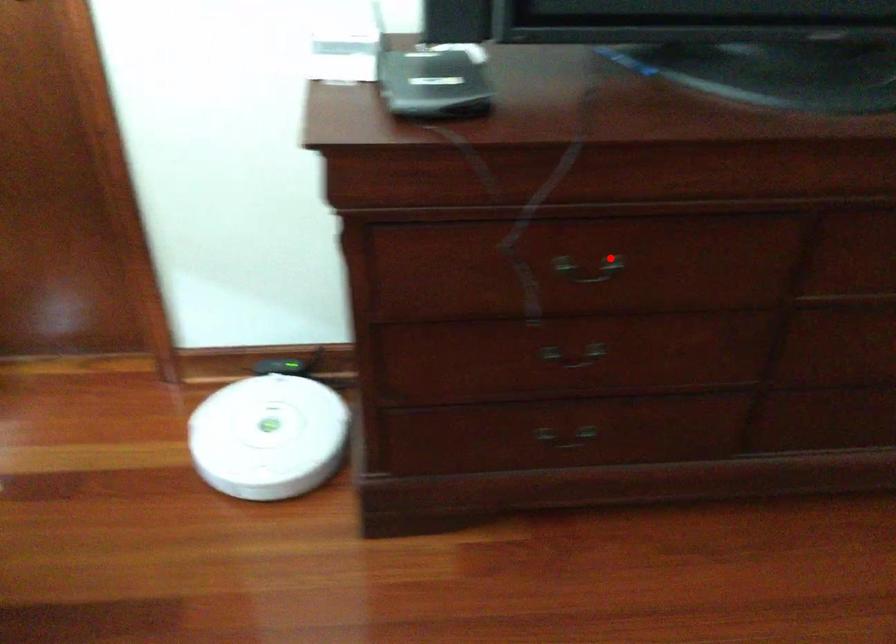
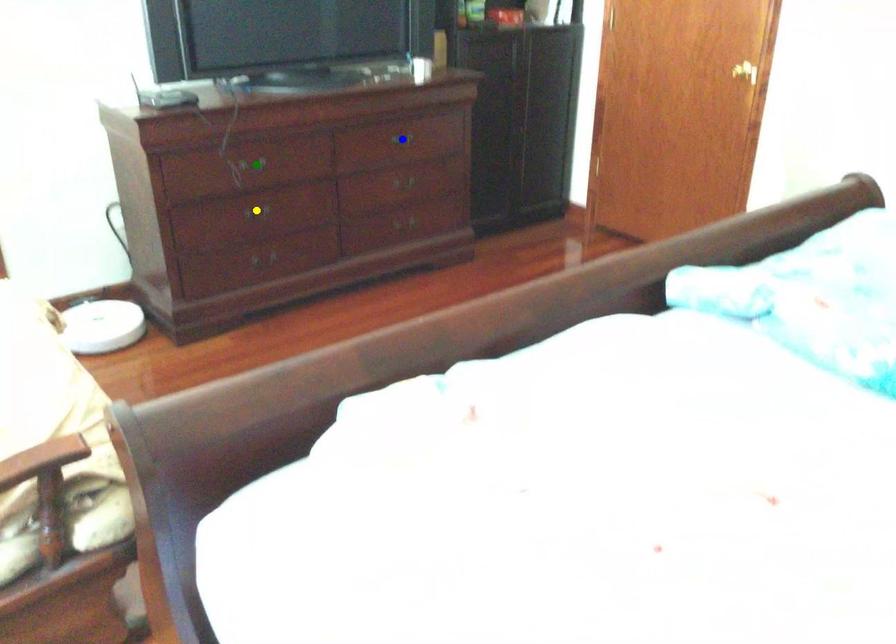
Question: I am providing you with two images of the same scene from different viewpoints. A red point is marked on the first image. You are given multiple points on the second image. Which spot in image 2 lines up with the point in image 1?

Choices:
 (A) blue point
 (B) yellow point
 (C) green point

Answer: (C)